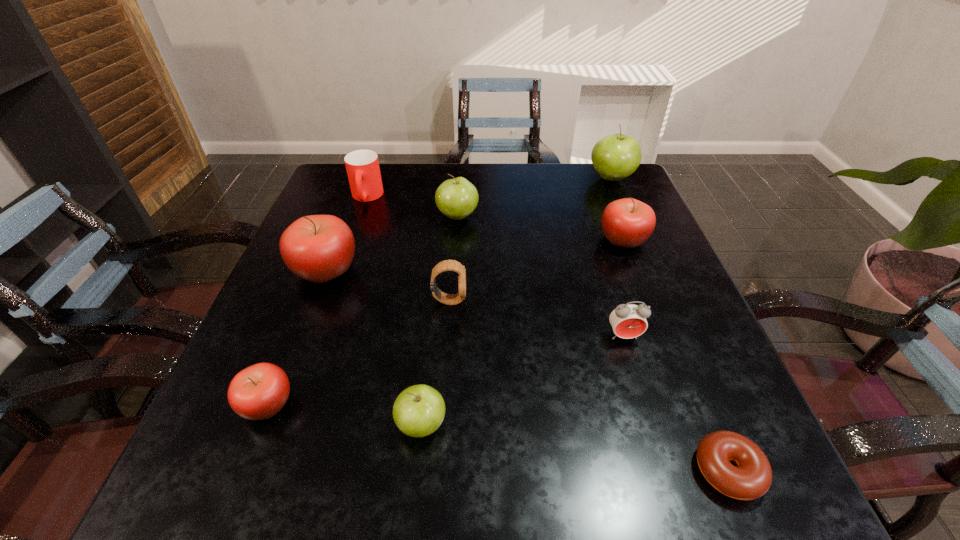
What are the coordinates of `the biggest green apple` in the screenshot? It's located at (614, 157).

You are a GUI agent. You are given a task and a screenshot of the screen. Output one action in this format:
    pyautogui.click(x=<x>, y=<y>)
    Task: Click on the farthest green apple
    This screenshot has height=540, width=960.
    Given the screenshot: What is the action you would take?
    pyautogui.click(x=614, y=157)

You are a GUI agent. You are given a task and a screenshot of the screen. Output one action in this format:
    pyautogui.click(x=<x>, y=<y>)
    Task: Click on the biggest red apple
    
    Given the screenshot: What is the action you would take?
    pyautogui.click(x=318, y=248)

Find the location of a particular element. This screenshot has height=540, width=960. the second biggest green apple is located at coordinates (457, 198).

I want to click on the rightmost red apple, so click(x=627, y=222).

The height and width of the screenshot is (540, 960). What are the coordinates of `cup` in the screenshot? It's located at (362, 166).

I want to click on watch, so pyautogui.click(x=448, y=265).

The height and width of the screenshot is (540, 960). I want to click on the fourth nearest object, so click(628, 321).

At what (x,y) coordinates should I click in order to perform the action: click on red alarm clock. Please return your answer as a coordinate pair (x, y). Looking at the image, I should click on tap(628, 321).

Image resolution: width=960 pixels, height=540 pixels. What are the coordinates of `the smallest green apple` in the screenshot? It's located at (418, 411).